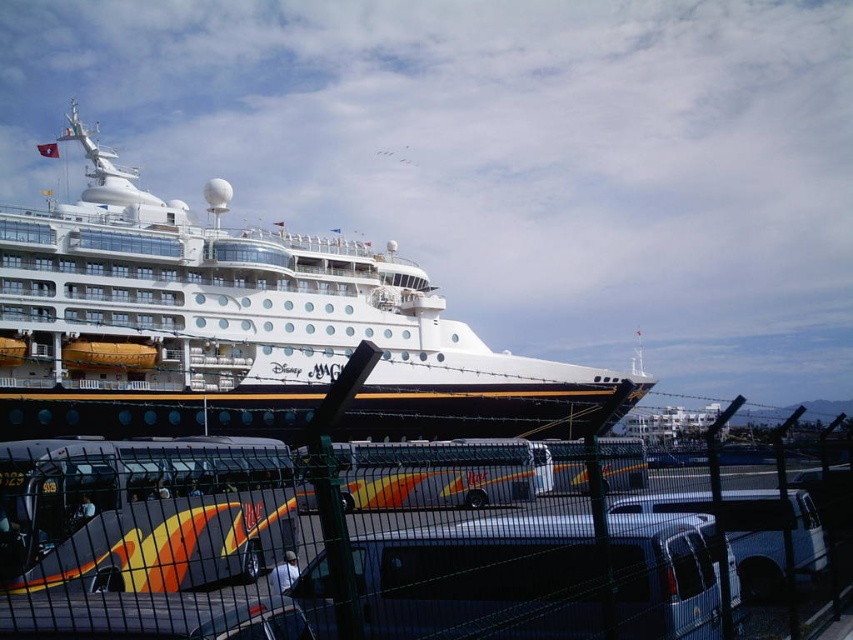
You are a delivery person trying to reach the white glossy cruise ship at center with a 20 meter long cargo truck. The truck is currently parked behind the black wire mesh fence at center. Can the truck reach the ship without detouring around the fence?

The black wire mesh fence at center and white glossy cruise ship at center are 18.92 meters apart from each other. Since the truck is 20 meters long, it cannot fit between them and would need to detour around the fence to reach the ship.

From the picture: You are standing on the dock near the Disney Magic cruise ship and want to take a photo. You notice two points marked in the image. The first point is at coordinates point (317, 532) and the second point is at point (32, 296). Which point is closer to you?

Point (317, 532) is closer to the viewer than point (32, 296).

You are standing on the dock and want to take a photo of the white glossy cruise ship at center without including the black wire mesh fence at center in the frame. Which direction should you move to achieve this?

Move to the left side of the white glossy cruise ship at center so that the black wire mesh fence at center is no longer in the frame.